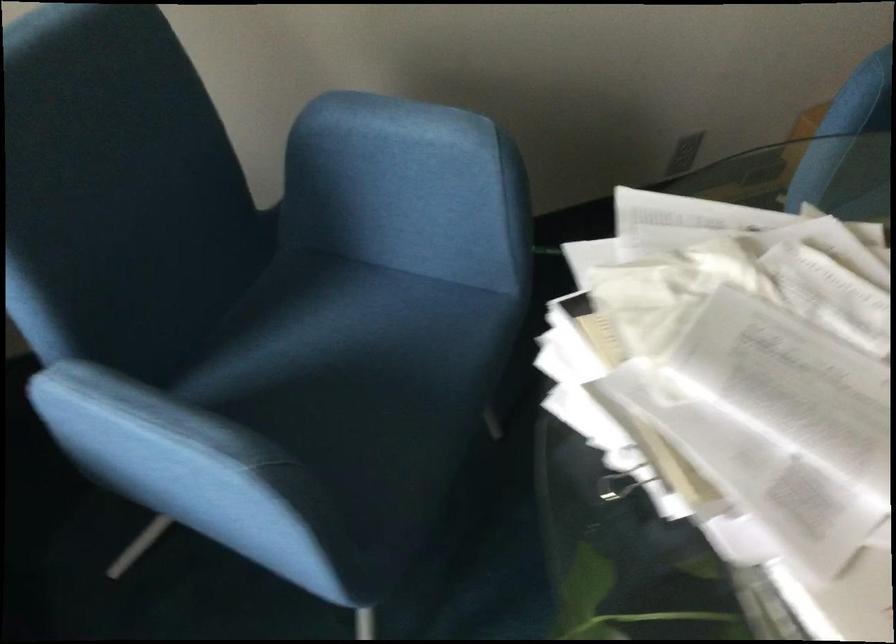
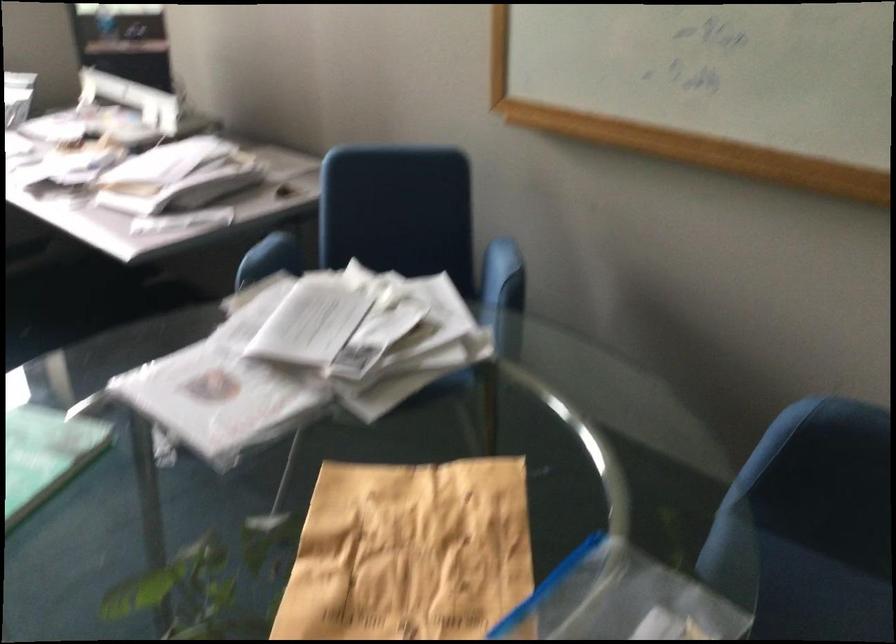
Locate, in the second image, the point that corresponds to pixel 186 242 in the first image.

(395, 268)